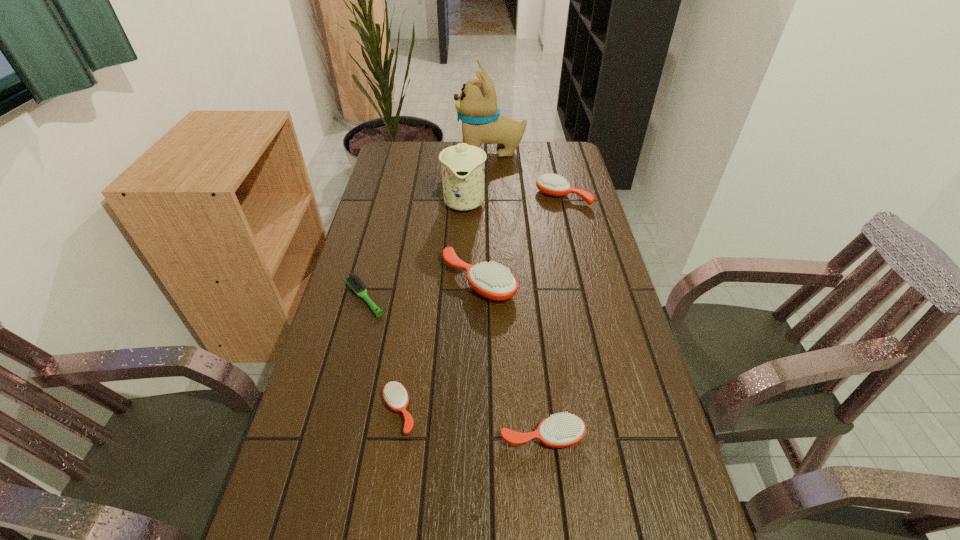
You are a GUI agent. You are given a task and a screenshot of the screen. Output one action in this format:
    pyautogui.click(x=<x>, y=<y>)
    Task: Click on the closest orange hairbrush relative to the second tallest object
    
    Given the screenshot: What is the action you would take?
    [551, 184]

At what (x,y) coordinates should I click in order to perform the action: click on free space in the image that satisfies the following two spatial constraints: 1. on the face of the farthest object; 2. on the spout of the sixth shortest object. Please return your answer as a coordinate pair (x, y). Looking at the image, I should click on (492, 202).

Where is `vacant region that satisfies the following two spatial constraints: 1. on the back side of the leftmost hairbrush; 2. on the left side of the fourth shortest object`? The height and width of the screenshot is (540, 960). vacant region that satisfies the following two spatial constraints: 1. on the back side of the leftmost hairbrush; 2. on the left side of the fourth shortest object is located at coordinates (390, 197).